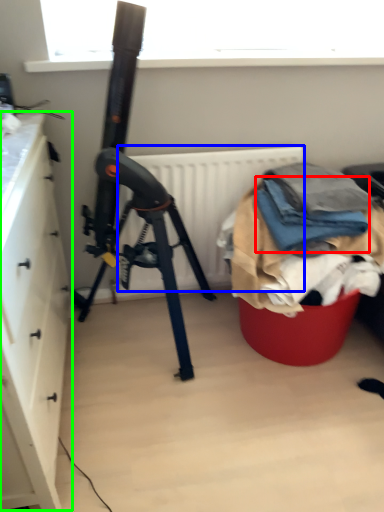
Question: Based on their relative distances, which object is farther from clothing (highlighted by a red box)? Choose from radiator (highlighted by a blue box) and cabinetry (highlighted by a green box).

Choices:
 (A) radiator
 (B) cabinetry

Answer: (B)